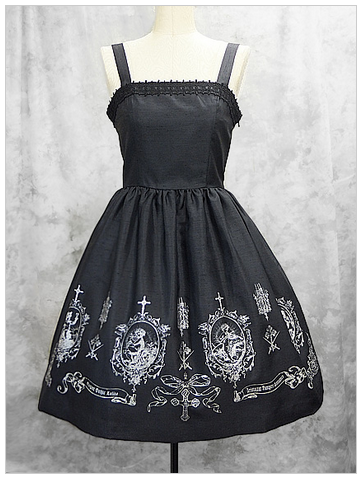
Find the location of a particular element. The height and width of the screenshot is (480, 363). dress form is located at coordinates (172, 66).